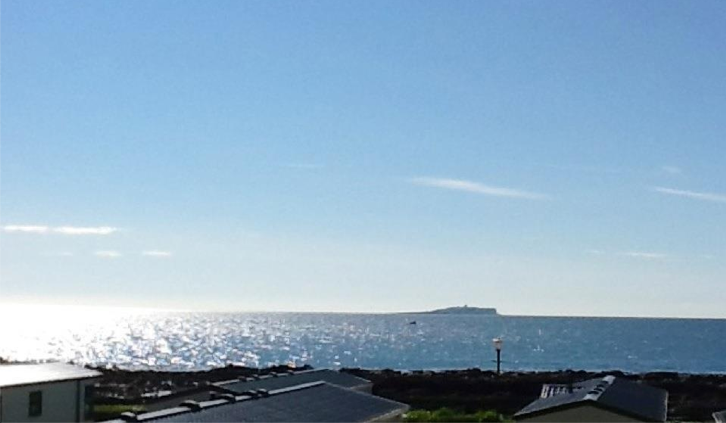
Where is `light`? The width and height of the screenshot is (726, 423). light is located at coordinates pyautogui.click(x=499, y=343).